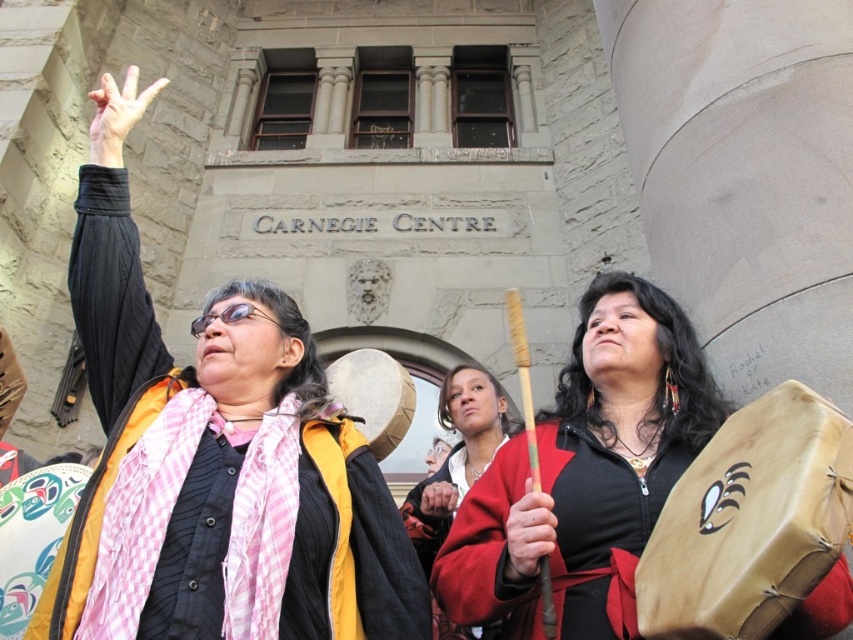
Question: Can you confirm if matte red coat at center is positioned to the right of smooth brown leather hand at center?

Choices:
 (A) yes
 (B) no

Answer: (A)

Question: Does leather drum at center have a larger size compared to matte red coat at center?

Choices:
 (A) no
 (B) yes

Answer: (A)

Question: Which object is closer to the camera taking this photo?

Choices:
 (A) smooth brown leather hand at center
 (B) matte black jacket at upper left

Answer: (B)

Question: Does leather drum at center have a lesser width compared to light skin tone flesh at upper left?

Choices:
 (A) no
 (B) yes

Answer: (B)

Question: Which of the following is the farthest from the observer?

Choices:
 (A) matte red coat at center
 (B) matte brown drum at center

Answer: (A)

Question: Estimate the real-world distances between objects in this image. Which object is farther from the matte black jacket at upper left?

Choices:
 (A) matte brown drum at center
 (B) light skin tone flesh at upper left
 (C) leather drum at center
 (D) matte red coat at center

Answer: (C)